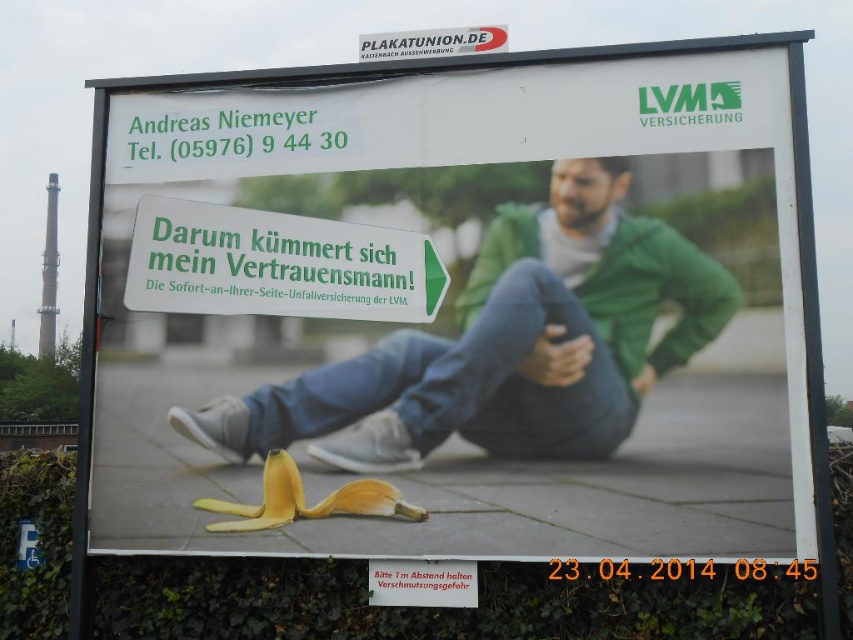
Question: Which point is closer to the camera taking this photo?

Choices:
 (A) (370, 490)
 (B) (445, 35)

Answer: (A)

Question: Which of the following is the closest to the observer?

Choices:
 (A) (412, 300)
 (B) (352, 392)
 (C) (490, 32)

Answer: (B)

Question: Is green matte jacket at center closer to camera compared to white plastic sign at upper center?

Choices:
 (A) yes
 (B) no

Answer: (A)

Question: Which of these objects is positioned closest to the yellow peel at lower center?

Choices:
 (A) green matte jacket at center
 (B) yellow matte banana peel at center
 (C) green plastic sign at center

Answer: (A)

Question: Does green matte jacket at center have a lesser width compared to yellow matte banana peel at center?

Choices:
 (A) yes
 (B) no

Answer: (B)

Question: Does yellow peel at lower center appear on the right side of yellow matte banana peel at center?

Choices:
 (A) yes
 (B) no

Answer: (A)